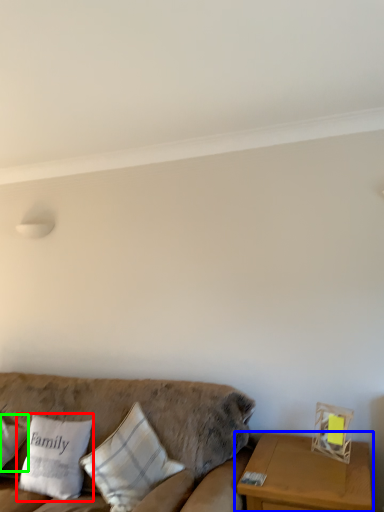
Question: Based on their relative distances, which object is nearer to pillow (highlighted by a red box)? Choose from table (highlighted by a blue box) and pillow (highlighted by a green box).

Choices:
 (A) table
 (B) pillow

Answer: (B)